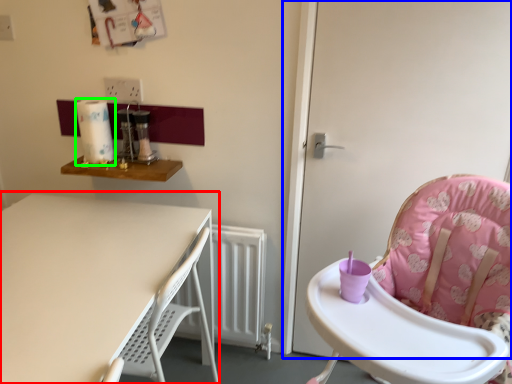
Question: Estimate the real-world distances between objects in this image. Which object is farther from table (highlighted by a red box), screen door (highlighted by a blue box) or paper towel (highlighted by a green box)?

Choices:
 (A) screen door
 (B) paper towel

Answer: (A)